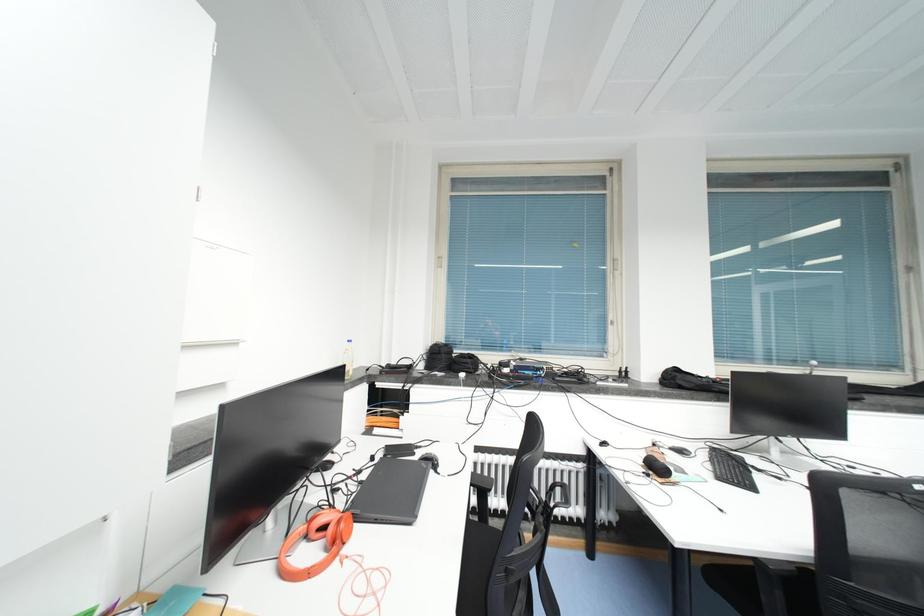
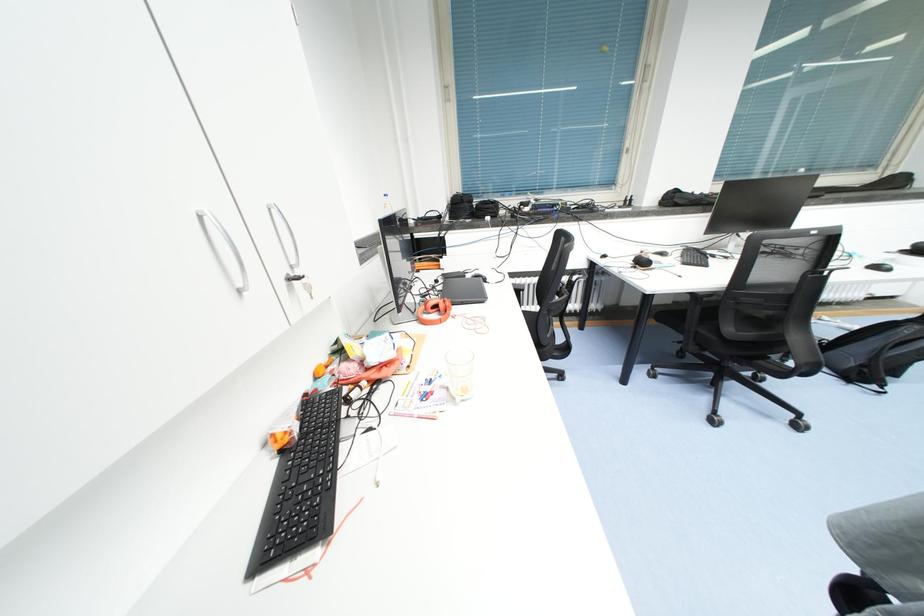
Question: The first image is from the beginning of the video and the second image is from the end. How did the camera likely rotate when shooting the video?

Choices:
 (A) Left
 (B) Right
 (C) Up
 (D) Down

Answer: (D)